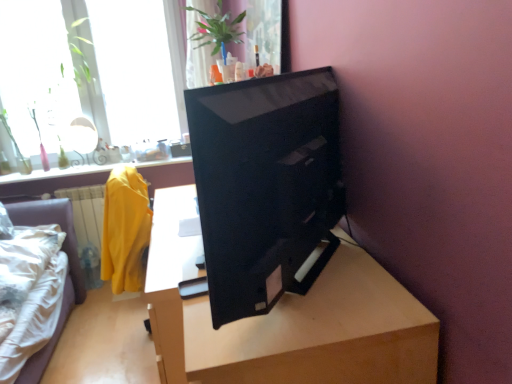
Question: Is white fabric bed at lower left wider than transparent glass window at upper left, positioned as the 1th window in right-to-left order?

Choices:
 (A) yes
 (B) no

Answer: (A)

Question: Is white fabric bed at lower left bigger than transparent glass window at upper left, positioned as the 1th window in right-to-left order?

Choices:
 (A) yes
 (B) no

Answer: (A)

Question: Can you confirm if white fabric bed at lower left is positioned to the left of transparent glass window at upper left, which is counted as the second window, starting from the left?

Choices:
 (A) no
 (B) yes

Answer: (B)

Question: Can you confirm if white fabric bed at lower left is thinner than transparent glass window at upper left, positioned as the 1th window in right-to-left order?

Choices:
 (A) yes
 (B) no

Answer: (B)

Question: Is white fabric bed at lower left smaller than transparent glass window at upper left, which is counted as the second window, starting from the left?

Choices:
 (A) no
 (B) yes

Answer: (A)

Question: Is white fabric bed at lower left outside transparent glass window at upper left, positioned as the 1th window in right-to-left order?

Choices:
 (A) no
 (B) yes

Answer: (B)

Question: From the image's perspective, is transparent glass window at upper left, which is the second window in right-to-left order, below light brown wood table at center?

Choices:
 (A) yes
 (B) no

Answer: (B)

Question: Is transparent glass window at upper left, which is the second window in right-to-left order, surrounding light brown wood table at center?

Choices:
 (A) no
 (B) yes

Answer: (A)

Question: Considering the relative sizes of transparent glass window at upper left, which is the second window in right-to-left order, and light brown wood table at center in the image provided, is transparent glass window at upper left, which is the second window in right-to-left order, thinner than light brown wood table at center?

Choices:
 (A) no
 (B) yes

Answer: (B)

Question: Is transparent glass window at upper left, which appears as the 1th window when viewed from the left, taller than light brown wood table at center?

Choices:
 (A) no
 (B) yes

Answer: (B)

Question: Can we say transparent glass window at upper left, which appears as the 1th window when viewed from the left, lies outside light brown wood table at center?

Choices:
 (A) no
 (B) yes

Answer: (B)

Question: Does transparent glass window at upper left, which is the second window in right-to-left order, lie behind light brown wood table at center?

Choices:
 (A) no
 (B) yes

Answer: (B)

Question: Would you say transparent glass window at upper left, which is counted as the second window, starting from the left, is outside transparent glass window at upper left, which appears as the 1th window when viewed from the left?

Choices:
 (A) yes
 (B) no

Answer: (A)